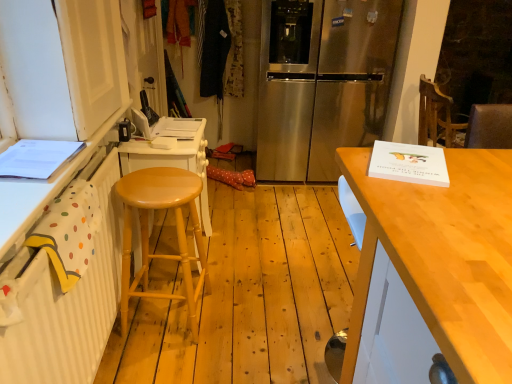
Find the location of a particular element. vacant point to the left of light wood table at right is located at coordinates (276, 340).